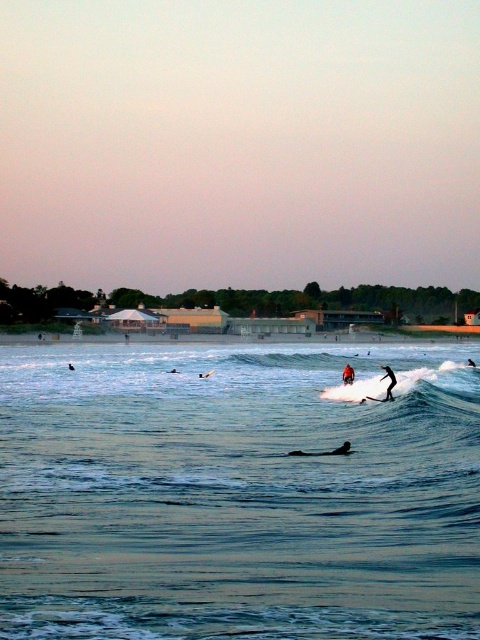
Who is positioned more to the right, clear blue water at center or black matte wetsuit at center?

From the viewer's perspective, black matte wetsuit at center appears more on the right side.

Is point (386, 586) farther from camera compared to point (383, 376)?

No, it is in front of (383, 376).

Who is more forward, (264, 612) or (395, 384)?

Positioned in front is point (264, 612).

At what (x,y) coordinates should I click in order to perform the action: click on clear blue water at center. Please return your answer as a coordinate pair (x, y). Looking at the image, I should click on (238, 493).

Who is shorter, dark blue wetsuit at center or black wetsuit surfer at center?

black wetsuit surfer at center is shorter.

Is point (312, 452) farther from viewer compared to point (472, 362)?

No, (312, 452) is closer to viewer.

Where is `dark blue wetsuit at center`? This screenshot has height=640, width=480. dark blue wetsuit at center is located at coordinates (324, 451).

Does dark blue wetsuit at center have a greater height compared to black matte wetsuit at center?

No, dark blue wetsuit at center is not taller than black matte wetsuit at center.

Is point (314, 452) less distant than point (393, 385)?

Yes, point (314, 452) is in front of point (393, 385).

Image resolution: width=480 pixels, height=640 pixels. In order to click on dark blue wetsuit at center in this screenshot , I will do `click(324, 451)`.